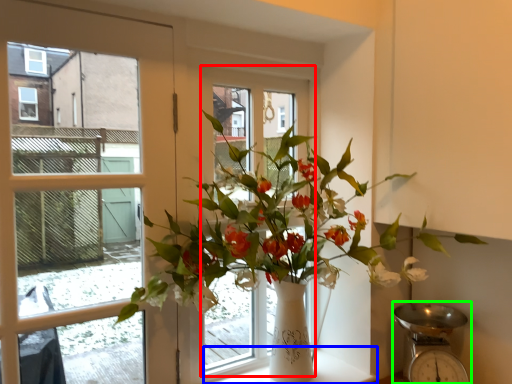
Question: Which object is positioned closest to window frame (highlighted by a red box)? Select from window sill (highlighted by a blue box) and scale (highlighted by a green box).

Choices:
 (A) window sill
 (B) scale

Answer: (B)